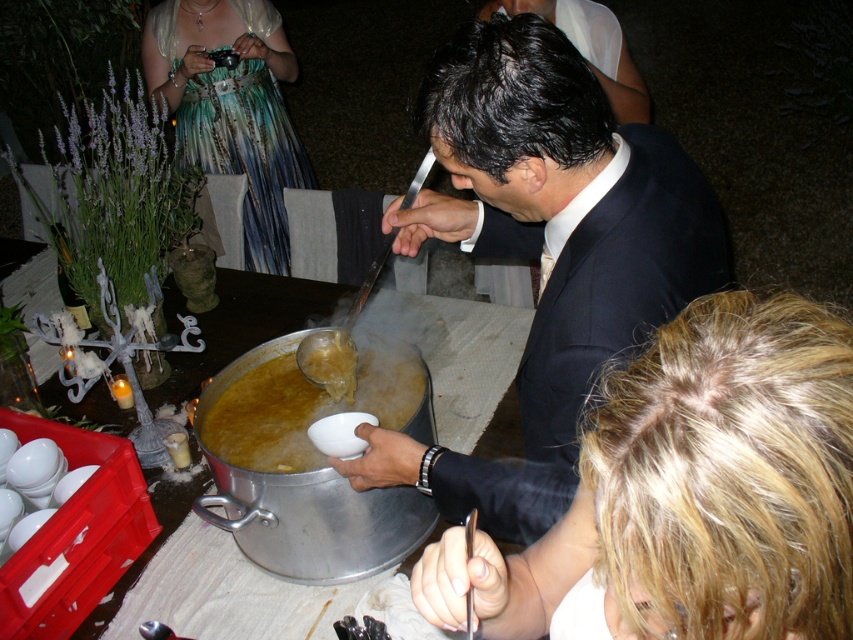
You are a guest at the event and want to find the shiny teal dress at upper left. Which direction should you look relative to the shiny black suit at center?

The shiny teal dress at upper left is above the shiny black suit at center, so you should look upward from the shiny black suit at center to find the shiny teal dress at upper left.